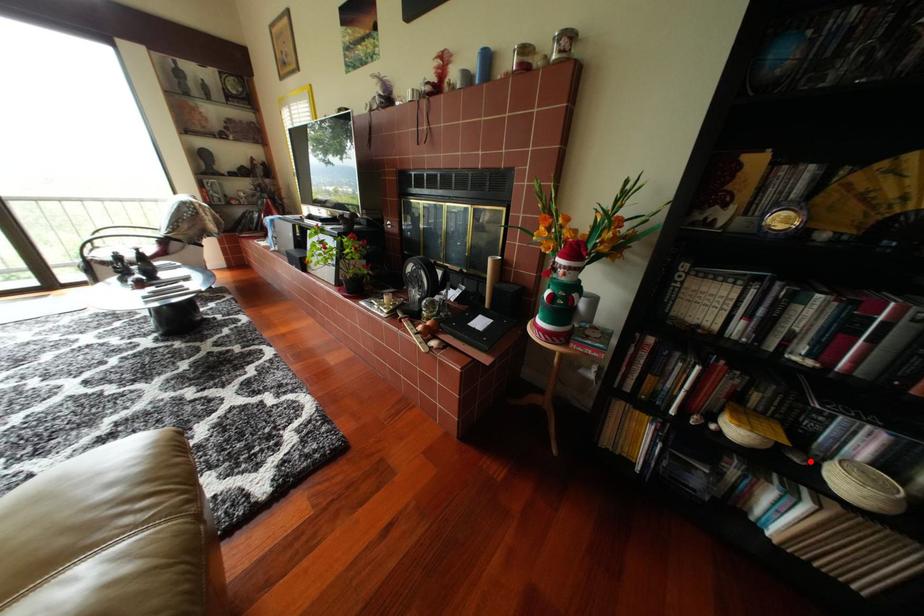
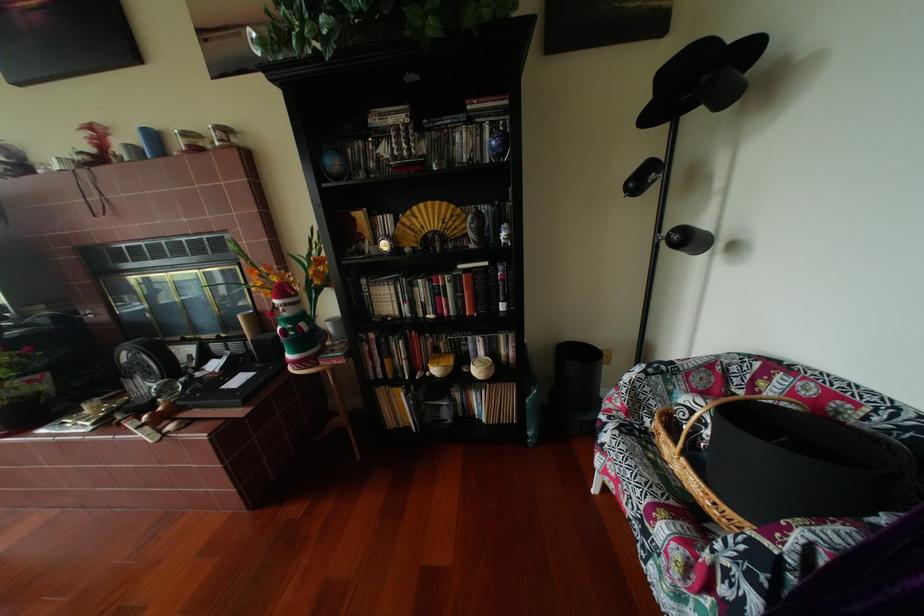
Locate, in the second image, the point that corresponds to the highlighted location in the first image.

(478, 371)